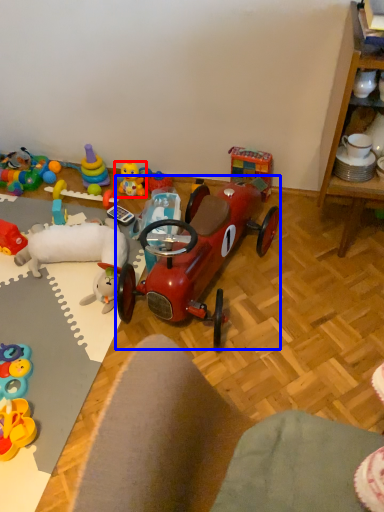
Question: Which of the following is the farthest to the observer, toy (highlighted by a red box) or toy (highlighted by a blue box)?

Choices:
 (A) toy
 (B) toy

Answer: (A)